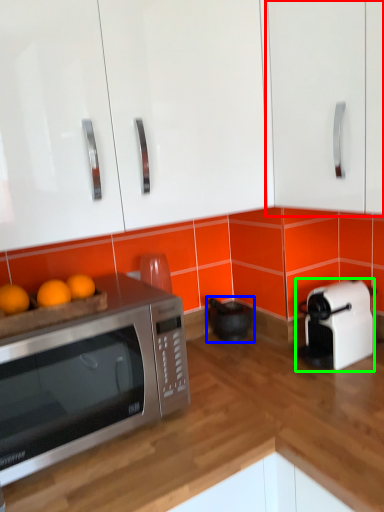
Question: Which object is positioned farthest from cabinetry (highlighted by a red box)? Select from appliance (highlighted by a blue box) and toaster (highlighted by a green box).

Choices:
 (A) appliance
 (B) toaster

Answer: (A)